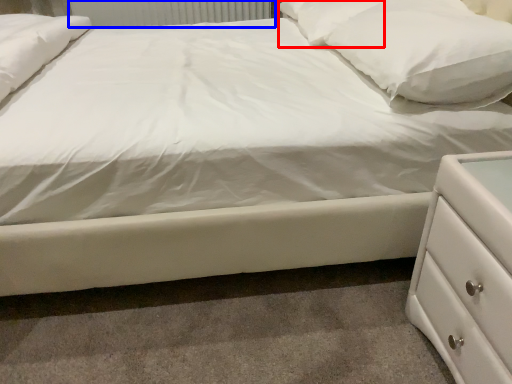
Question: Which of the following is the closest to the observer, pillow (highlighted by a red box) or radiator (highlighted by a blue box)?

Choices:
 (A) pillow
 (B) radiator

Answer: (A)